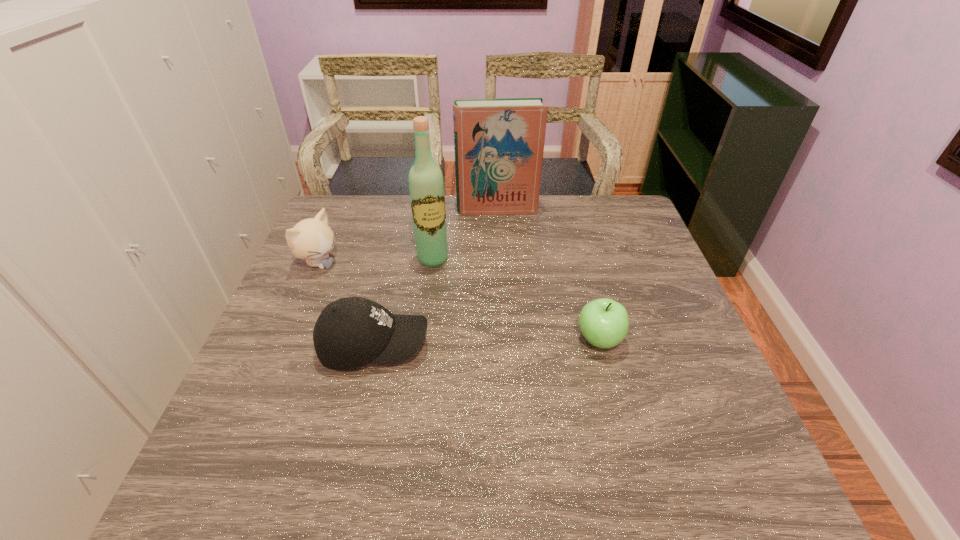
You are a GUI agent. You are given a task and a screenshot of the screen. Output one action in this format:
    pyautogui.click(x=<x>, y=<y>)
    Task: Click on the baseball cap
    This screenshot has height=540, width=960.
    Given the screenshot: What is the action you would take?
    pyautogui.click(x=350, y=332)

The image size is (960, 540). I want to click on the rightmost object, so click(604, 323).

Locate an element on the screen. Image resolution: width=960 pixels, height=540 pixels. wine bottle is located at coordinates (426, 186).

Image resolution: width=960 pixels, height=540 pixels. In order to click on the farthest object in this screenshot , I will do `click(499, 143)`.

Where is `the second object from right to left`? This screenshot has height=540, width=960. the second object from right to left is located at coordinates (499, 143).

What are the coordinates of `the leftmost object` in the screenshot? It's located at (312, 239).

Where is `kitten`? The image size is (960, 540). kitten is located at coordinates (312, 239).

Identify the location of free location located on the front-facing side of the baseball cap. (492, 346).

Find the location of a particular element. The height and width of the screenshot is (540, 960). free point located 0.210m on the left of the rightmost object is located at coordinates [x=489, y=340].

Locate an element on the screen. This screenshot has width=960, height=540. vacant position located on the front-facing side of the wine bottle is located at coordinates (444, 294).